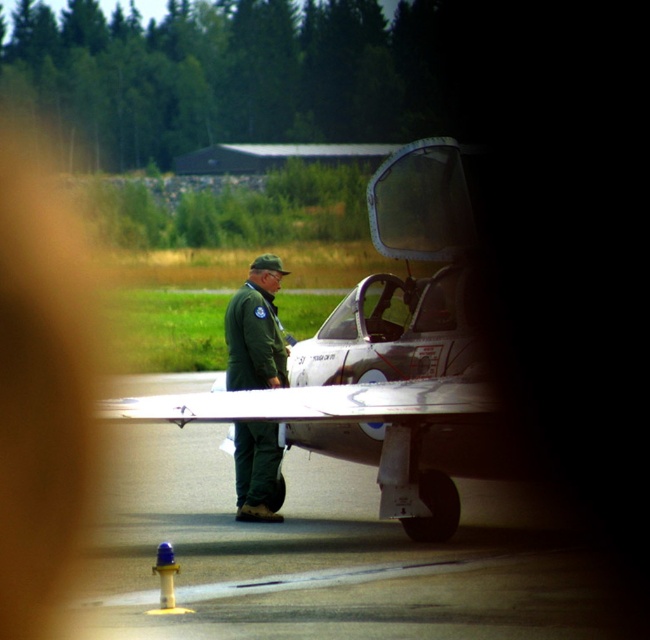
You are a pilot preparing to board your aircraft. You notice the silver metallic jet at center and the green matte uniform at center. Which object is closer to the cockpit door?

The silver metallic jet at center is positioned over the green matte uniform at center, meaning the jet is closer to the cockpit door than the uniform.

You are a pilot preparing to taxi the silver metallic jet at center from its current position. The smooth asphalt tarmac at center is to your left. Which direction should you turn to align with the runway if the runway is to the right of the jet?

The smooth asphalt tarmac at center is on the left side of the silver metallic jet at center. To align with the runway to the right of the jet, you should turn right towards the runway.

You are a pilot preparing to board the aircraft. You need to determine if you can safely step onto the silver metallic jet at center from the green matte uniform at center. Can you do so based on their heights?

The silver metallic jet at center is taller than the green matte uniform at center, so you can safely step onto the silver metallic jet at center from the green matte uniform at center because it is higher.